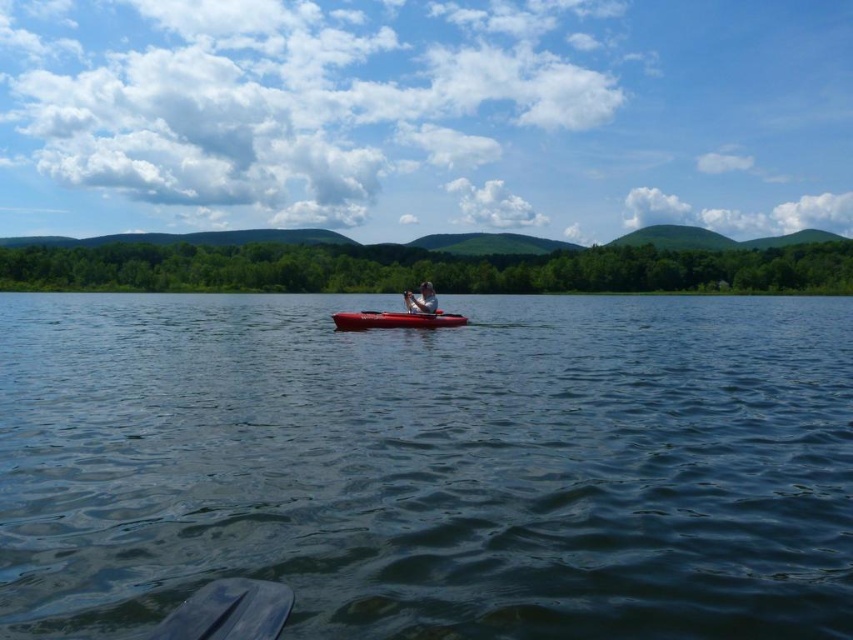
You are a photographer planning to capture a landscape shot of the dark blue water at center and the matte gray kayak at center. Based on their positions in the scene, which object will appear larger in your photo?

The dark blue water at center appears larger in the photo because it is positioned closer to the camera than the matte gray kayak at center, making it appear taller and thus larger in the frame.

You are standing on a dock and want to toss a small floating toy into the dark blue water at center. If the toy floats and you can throw it 4 meters, will it land in the water?

The dark blue water at center is 4.30 meters away from the viewer. Since the toy can only be thrown 4 meters, it won not reach the water.

You are standing on the lakeside and want to take a photo of both point [422,298] and point [364,312] in the scene. Which point will appear larger in your photo?

Point [422,298] will appear larger in the photo because it is closer to the camera than point [364,312].